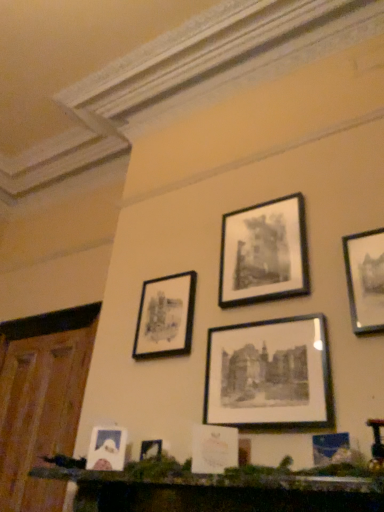
The width and height of the screenshot is (384, 512). Find the location of `matte black picture frame at upper right, arranged as the 1th picture frame when viewed from the right`. matte black picture frame at upper right, arranged as the 1th picture frame when viewed from the right is located at coordinates (365, 280).

What is the approximate width of black matte picture frame at center, the 3th picture frame from the right?

1.88 inches.

At what (x,y) coordinates should I click in order to perform the action: click on black matte picture frame at center, which appears as the fourth picture frame when viewed from the left. Please return your answer as a coordinate pair (x, y). Looking at the image, I should click on (269, 375).

I want to click on matte white picture frame at center, the third picture frame when ordered from left to right, so [x=214, y=449].

In order to face black matte picture frame at upper center, placed as the 5th picture frame when sorted from left to right, should I rotate leftwards or rightwards?

A 9.200 degree turn to the right will do.

At what (x,y) coordinates should I click in order to perform the action: click on matte black picture frame at upper center, the second picture frame viewed from the left. Please return your answer as a coordinate pair (x, y). The height and width of the screenshot is (512, 384). Looking at the image, I should click on (165, 317).

Consider the image. In terms of width, does black matte picture frame at center, the 3th picture frame from the right, look wider or thinner when compared to black matte picture frame at upper center, which is the 2th picture frame in right-to-left order?

Considering their sizes, black matte picture frame at center, the 3th picture frame from the right, looks slimmer than black matte picture frame at upper center, which is the 2th picture frame in right-to-left order.

From the image's perspective, which one is positioned lower, black matte picture frame at center, which appears as the fourth picture frame when viewed from the left, or black matte picture frame at upper center, placed as the 5th picture frame when sorted from left to right?

From the image's view, black matte picture frame at center, which appears as the fourth picture frame when viewed from the left, is below.

From their relative heights in the image, would you say black matte picture frame at center, the 3th picture frame from the right, is taller or shorter than black matte picture frame at upper center, which is the 2th picture frame in right-to-left order?

Clearly, black matte picture frame at center, the 3th picture frame from the right, is shorter compared to black matte picture frame at upper center, which is the 2th picture frame in right-to-left order.

Are black matte picture frame at center, the 3th picture frame from the right, and black matte picture frame at upper center, placed as the 5th picture frame when sorted from left to right, making contact?

black matte picture frame at center, the 3th picture frame from the right, is not next to black matte picture frame at upper center, placed as the 5th picture frame when sorted from left to right, and they're not touching.

Between black matte picture frame at upper center, which is the 2th picture frame in right-to-left order, and matte white picture frame at lower left, which is counted as the first picture frame, starting from the left, which one has less height?

Standing shorter between the two is matte white picture frame at lower left, which is counted as the first picture frame, starting from the left.

Who is smaller, black matte picture frame at upper center, which is the 2th picture frame in right-to-left order, or matte white picture frame at lower left, which is counted as the first picture frame, starting from the left?

matte white picture frame at lower left, which is counted as the first picture frame, starting from the left, is smaller.

How much distance is there between black matte picture frame at upper center, placed as the 5th picture frame when sorted from left to right, and matte white picture frame at lower left, which ranks as the 6th picture frame in right-to-left order?

A distance of 96.35 centimeters exists between black matte picture frame at upper center, placed as the 5th picture frame when sorted from left to right, and matte white picture frame at lower left, which ranks as the 6th picture frame in right-to-left order.

Is black matte picture frame at upper center, which is the 2th picture frame in right-to-left order, next to matte white picture frame at lower left, which ranks as the 6th picture frame in right-to-left order?

They are not placed beside each other.

This screenshot has height=512, width=384. Find the location of `the 1st picture frame to the left when counting from the black matte picture frame at upper center, placed as the 5th picture frame when sorted from left to right`. the 1st picture frame to the left when counting from the black matte picture frame at upper center, placed as the 5th picture frame when sorted from left to right is located at coordinates (269, 375).

Can you confirm if black matte picture frame at upper center, which is the 2th picture frame in right-to-left order, is wider than black matte picture frame at center, the 3th picture frame from the right?

Indeed, black matte picture frame at upper center, which is the 2th picture frame in right-to-left order, has a greater width compared to black matte picture frame at center, the 3th picture frame from the right.

Consider the image. From the image's perspective, who appears lower, black matte picture frame at upper center, placed as the 5th picture frame when sorted from left to right, or black matte picture frame at center, which appears as the fourth picture frame when viewed from the left?

From the image's view, black matte picture frame at center, which appears as the fourth picture frame when viewed from the left, is below.

Is black matte picture frame at upper center, which is the 2th picture frame in right-to-left order, to the right of black matte picture frame at center, which appears as the fourth picture frame when viewed from the left, from the viewer's perspective?

Indeed, black matte picture frame at upper center, which is the 2th picture frame in right-to-left order, is positioned on the right side of black matte picture frame at center, which appears as the fourth picture frame when viewed from the left.

Between matte black picture frame at upper right, arranged as the 1th picture frame when viewed from the right, and wooden mantelpiece at lower center, which one has larger width?

With larger width is wooden mantelpiece at lower center.

Would you say matte black picture frame at upper right, arranged as the 1th picture frame when viewed from the right, is to the left or to the right of wooden mantelpiece at lower center in the picture?

From the image, it's evident that matte black picture frame at upper right, arranged as the 1th picture frame when viewed from the right, is to the right of wooden mantelpiece at lower center.

From their relative heights in the image, would you say matte black picture frame at upper right, placed as the sixth picture frame when sorted from left to right, is taller or shorter than wooden mantelpiece at lower center?

In the image, matte black picture frame at upper right, placed as the sixth picture frame when sorted from left to right, appears to be taller than wooden mantelpiece at lower center.

Is matte black picture frame at upper right, placed as the sixth picture frame when sorted from left to right, directly adjacent to wooden mantelpiece at lower center?

matte black picture frame at upper right, placed as the sixth picture frame when sorted from left to right, and wooden mantelpiece at lower center are clearly separated.

Does black matte picture frame at upper center, placed as the 5th picture frame when sorted from left to right, have a lesser width compared to wooden mantelpiece at lower center?

Correct, the width of black matte picture frame at upper center, placed as the 5th picture frame when sorted from left to right, is less than that of wooden mantelpiece at lower center.

Does point (235, 290) appear closer or farther from the camera than point (243, 484)?

Point (235, 290) appears to be farther away from the viewer than point (243, 484).

Can you confirm if black matte picture frame at upper center, which is the 2th picture frame in right-to-left order, is taller than wooden mantelpiece at lower center?

Indeed, black matte picture frame at upper center, which is the 2th picture frame in right-to-left order, has a greater height compared to wooden mantelpiece at lower center.

What's the angular difference between black matte picture frame at upper center, which is the 2th picture frame in right-to-left order, and wooden mantelpiece at lower center's facing directions?

black matte picture frame at upper center, which is the 2th picture frame in right-to-left order, and wooden mantelpiece at lower center are facing 1.56 degrees away from each other.

This screenshot has width=384, height=512. In order to click on furniture on the left of matte white picture frame at center, the third picture frame when ordered from left to right in this screenshot , I will do `click(219, 492)`.

Which is closer to the camera, (196,506) or (223,426)?

Point (196,506)

In terms of height, does wooden mantelpiece at lower center look taller or shorter compared to matte white picture frame at center, the third picture frame when ordered from left to right?

wooden mantelpiece at lower center is shorter than matte white picture frame at center, the third picture frame when ordered from left to right.

Relative to matte white picture frame at center, the fourth picture frame when ordered from right to left, is wooden mantelpiece at lower center in front or behind?

wooden mantelpiece at lower center is positioned closer to the viewer than matte white picture frame at center, the fourth picture frame when ordered from right to left.

Is black matte picture frame at center, the 3th picture frame from the right, oriented away from matte white picture frame at lower left, which ranks as the 6th picture frame in right-to-left order?

No, black matte picture frame at center, the 3th picture frame from the right,'s orientation is not away from matte white picture frame at lower left, which ranks as the 6th picture frame in right-to-left order.

Does black matte picture frame at center, which appears as the fourth picture frame when viewed from the left, have a larger size compared to matte white picture frame at lower left, which ranks as the 6th picture frame in right-to-left order?

Yes.

In the image, is black matte picture frame at center, which appears as the fourth picture frame when viewed from the left, on the left side or the right side of matte white picture frame at lower left, which is counted as the first picture frame, starting from the left?

Clearly, black matte picture frame at center, which appears as the fourth picture frame when viewed from the left, is on the right of matte white picture frame at lower left, which is counted as the first picture frame, starting from the left, in the image.

From a real-world perspective, is black matte picture frame at center, which appears as the fourth picture frame when viewed from the left, positioned above or below matte white picture frame at lower left, which ranks as the 6th picture frame in right-to-left order?

Clearly, from a real-world perspective, black matte picture frame at center, which appears as the fourth picture frame when viewed from the left, is above matte white picture frame at lower left, which ranks as the 6th picture frame in right-to-left order.

The height and width of the screenshot is (512, 384). I want to click on picture frame that is the 3rd one when counting downward from the black matte picture frame at upper center, which is the 2th picture frame in right-to-left order (from the image's perspective), so click(269, 375).

From the black matte picture frame at upper center, which is the 2th picture frame in right-to-left order, count 1st picture frames forward and point to it. Please provide its 2D coordinates.

[(107, 449)]

Based on their spatial positions, is matte black picture frame at upper right, placed as the sixth picture frame when sorted from left to right, or wooden at left further from matte black picture frame at upper center, the 5th picture frame when ordered from right to left?

Among the two, wooden at left is located further to matte black picture frame at upper center, the 5th picture frame when ordered from right to left.

Based on the photo, estimate the real-world distances between objects in this image. Which object is closer to black matte picture frame at center, which appears as the fourth picture frame when viewed from the left, wooden mantelpiece at lower center or wooden at left?

The object closer to black matte picture frame at center, which appears as the fourth picture frame when viewed from the left, is wooden mantelpiece at lower center.

Estimate the real-world distances between objects in this image. Which object is closer to matte white picture frame at center, the third picture frame when ordered from left to right, wooden mantelpiece at lower center or black matte picture frame at upper center, placed as the 5th picture frame when sorted from left to right?

Among the two, wooden mantelpiece at lower center is located nearer to matte white picture frame at center, the third picture frame when ordered from left to right.

Estimate the real-world distances between objects in this image. Which object is closer to black matte picture frame at upper center, which is the 2th picture frame in right-to-left order, matte black picture frame at upper right, placed as the sixth picture frame when sorted from left to right, or black matte picture frame at center, which appears as the fourth picture frame when viewed from the left?

Among the two, black matte picture frame at center, which appears as the fourth picture frame when viewed from the left, is located nearer to black matte picture frame at upper center, which is the 2th picture frame in right-to-left order.

Estimate the real-world distances between objects in this image. Which object is closer to matte white picture frame at center, the third picture frame when ordered from left to right, matte white picture frame at lower left, which is counted as the first picture frame, starting from the left, or wooden mantelpiece at lower center?

The object closer to matte white picture frame at center, the third picture frame when ordered from left to right, is wooden mantelpiece at lower center.

Considering their positions, is matte white picture frame at lower left, which is counted as the first picture frame, starting from the left, positioned closer to matte black picture frame at upper right, placed as the sixth picture frame when sorted from left to right, than wooden at left?

Based on the image, matte white picture frame at lower left, which is counted as the first picture frame, starting from the left, appears to be nearer to matte black picture frame at upper right, placed as the sixth picture frame when sorted from left to right.

When comparing their distances from matte white picture frame at lower left, which ranks as the 6th picture frame in right-to-left order, does wooden at left or wooden mantelpiece at lower center seem closer?

wooden mantelpiece at lower center lies closer to matte white picture frame at lower left, which ranks as the 6th picture frame in right-to-left order, than the other object.

Considering their positions, is matte white picture frame at lower left, which ranks as the 6th picture frame in right-to-left order, positioned closer to matte white picture frame at center, the fourth picture frame when ordered from right to left, than black matte picture frame at center, the 3th picture frame from the right?

black matte picture frame at center, the 3th picture frame from the right, is closer to matte white picture frame at center, the fourth picture frame when ordered from right to left.

Where is `furniture between wooden at left and matte black picture frame at upper right, arranged as the 1th picture frame when viewed from the right, from left to right`? furniture between wooden at left and matte black picture frame at upper right, arranged as the 1th picture frame when viewed from the right, from left to right is located at coordinates (219, 492).

The height and width of the screenshot is (512, 384). I want to click on furniture between matte white picture frame at lower left, which is counted as the first picture frame, starting from the left, and black matte picture frame at center, the 3th picture frame from the right, in the horizontal direction, so click(x=219, y=492).

Identify the location of furniture between wooden at left and black matte picture frame at center, the 3th picture frame from the right. (219, 492).

The width and height of the screenshot is (384, 512). Find the location of `furniture between matte white picture frame at lower left, which is counted as the first picture frame, starting from the left, and matte black picture frame at upper right, placed as the sixth picture frame when sorted from left to right`. furniture between matte white picture frame at lower left, which is counted as the first picture frame, starting from the left, and matte black picture frame at upper right, placed as the sixth picture frame when sorted from left to right is located at coordinates (219, 492).